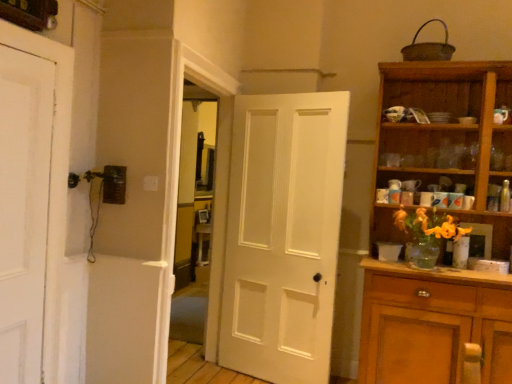
Question: Considering the positions of white matte door at left, acting as the first door starting from the left, and wooden cabinet at right in the image, is white matte door at left, acting as the first door starting from the left, taller or shorter than wooden cabinet at right?

Choices:
 (A) tall
 (B) short

Answer: (B)

Question: From a real-world perspective, is white matte door at left, acting as the first door starting from the left, above or below wooden cabinet at right?

Choices:
 (A) below
 (B) above

Answer: (B)

Question: Which of these objects is positioned closest to the white matte door at center, the 1th door when ordered from back to front?

Choices:
 (A) wooden cabinet at right
 (B) white matte door at left, acting as the first door starting from the left

Answer: (A)

Question: Based on their relative distances, which object is farther from the white matte door at left, acting as the first door starting from the left?

Choices:
 (A) white matte door at center, the 1th door when ordered from back to front
 (B) wooden cabinet at right

Answer: (B)